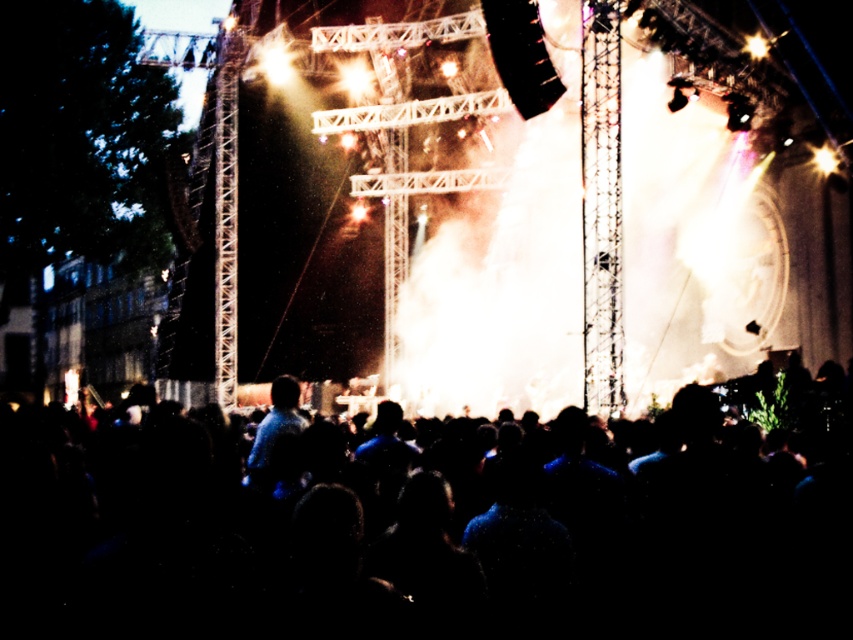
Which is in front, point (792, 493) or point (271, 477)?

Point (792, 493) is more forward.

Is black matte crowd at center to the right of blue fabric shirt at center from the viewer's perspective?

Correct, you'll find black matte crowd at center to the right of blue fabric shirt at center.

This screenshot has width=853, height=640. Describe the element at coordinates (427, 531) in the screenshot. I see `black matte crowd at center` at that location.

Locate an element on the screen. black matte crowd at center is located at coordinates (427, 531).